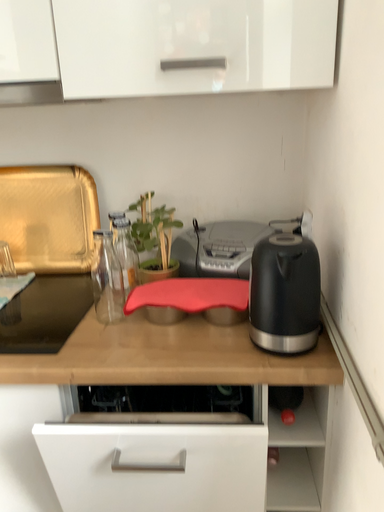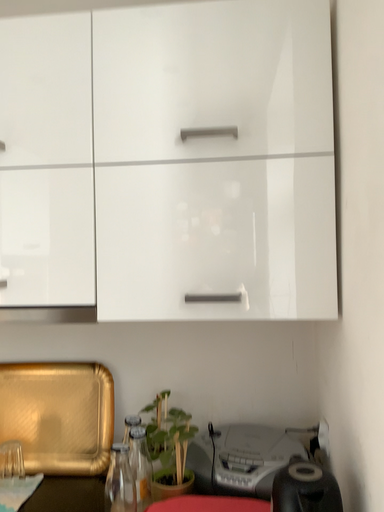
Question: Which way did the camera rotate in the video?

Choices:
 (A) rotated upward
 (B) rotated downward

Answer: (A)